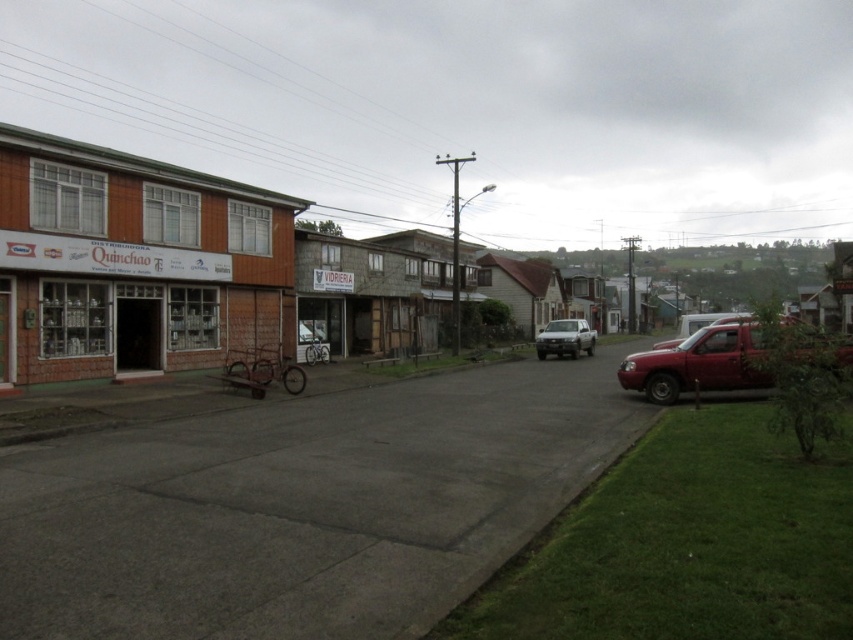
Is metallic red pickup truck at right positioned behind metallic red truck at right?

No.

How distant is metallic red pickup truck at right from metallic red truck at right?

They are 6.91 meters apart.

Which is in front, point (648, 381) or point (674, 340)?

Point (648, 381) is more forward.

I want to click on metallic red pickup truck at right, so click(x=699, y=364).

From the picture: Between brown wooden store at left and metallic red pickup truck at right, which one has less height?

metallic red pickup truck at right

Is brown wooden store at left to the left of metallic red pickup truck at right from the viewer's perspective?

Correct, you'll find brown wooden store at left to the left of metallic red pickup truck at right.

What do you see at coordinates (132, 262) in the screenshot?
I see `brown wooden store at left` at bounding box center [132, 262].

The width and height of the screenshot is (853, 640). I want to click on brown wooden store at left, so pyautogui.click(x=132, y=262).

Who is shorter, brown wooden building at left or metallic red truck at right?

metallic red truck at right

Does brown wooden building at left have a greater width compared to metallic red truck at right?

In fact, brown wooden building at left might be narrower than metallic red truck at right.

Locate an element on the screen. This screenshot has height=640, width=853. brown wooden building at left is located at coordinates (134, 264).

The height and width of the screenshot is (640, 853). Find the location of `brown wooden building at left`. brown wooden building at left is located at coordinates (134, 264).